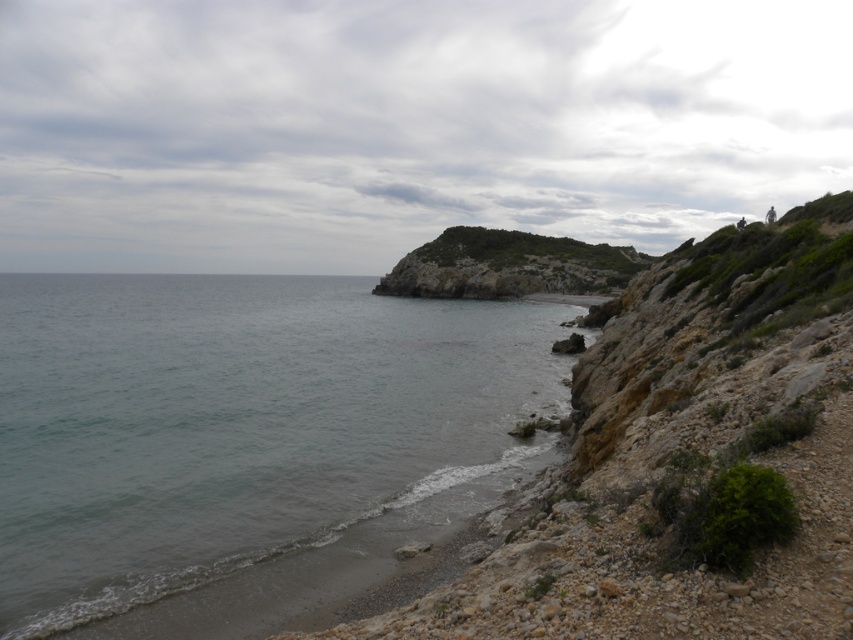
Question: Can you confirm if clear water at lower left is wider than green rocky hillside at center?

Choices:
 (A) yes
 (B) no

Answer: (A)

Question: Does clear water at lower left have a smaller size compared to green rocky hillside at center?

Choices:
 (A) yes
 (B) no

Answer: (B)

Question: Which object is farther from the camera taking this photo?

Choices:
 (A) clear water at lower left
 (B) green rocky hillside at center

Answer: (B)

Question: Which point is closer to the camera?

Choices:
 (A) (207, 557)
 (B) (461, 250)

Answer: (A)

Question: Does clear water at lower left appear on the right side of green rocky hillside at center?

Choices:
 (A) no
 (B) yes

Answer: (A)

Question: Which object appears closest to the camera in this image?

Choices:
 (A) clear water at lower left
 (B) green rocky hillside at center

Answer: (A)